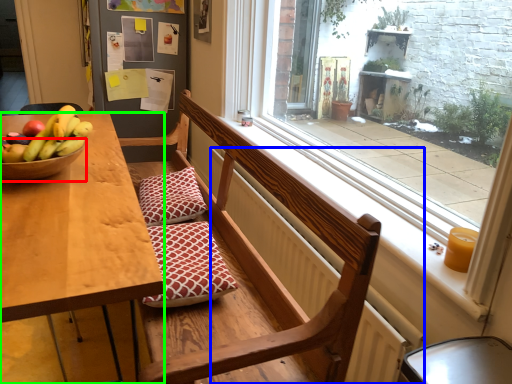
Question: Based on their relative distances, which object is farther from glass bowl (highlighted by a red box)? Choose from radiator (highlighted by a blue box) and kitchen & dining room table (highlighted by a green box).

Choices:
 (A) radiator
 (B) kitchen & dining room table

Answer: (A)